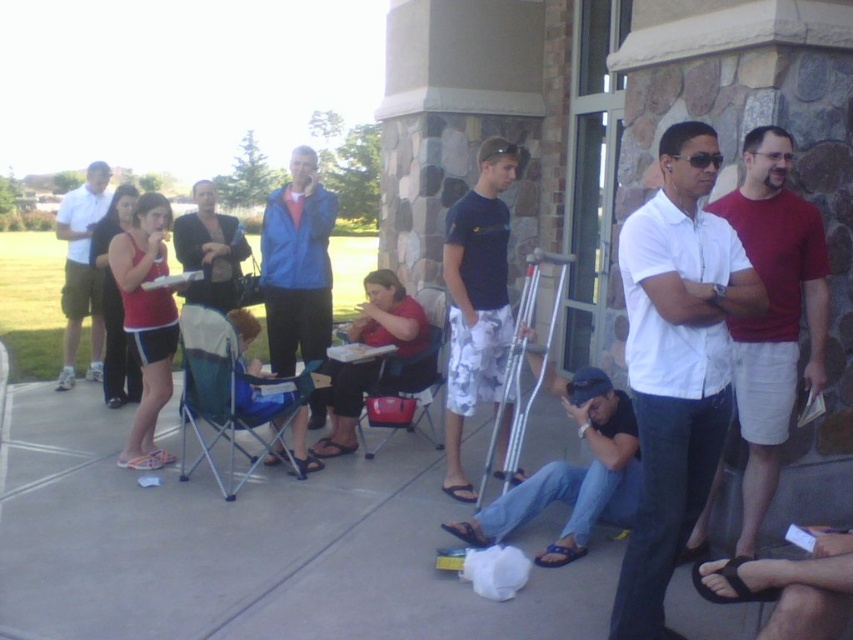
Can you confirm if denim jeans at lower center is taller than blue fabric chair at center?

No, denim jeans at lower center is not taller than blue fabric chair at center.

Measure the distance between denim jeans at lower center and blue fabric chair at center.

denim jeans at lower center and blue fabric chair at center are 1.36 meters apart from each other.

Does point (576, 502) lie in front of point (436, 340)?

Yes, it is in front of point (436, 340).

Locate an element on the screen. The height and width of the screenshot is (640, 853). denim jeans at lower center is located at coordinates (572, 476).

Does white cotton shirt at center appear on the right side of white matte shorts at left?

Yes, white cotton shirt at center is to the right of white matte shorts at left.

Can you confirm if white cotton shirt at center is thinner than white matte shorts at left?

Yes.

The height and width of the screenshot is (640, 853). Identify the location of white cotton shirt at center. (676, 364).

Based on the photo, who is shorter, dark blue t-shirt at center or blue fabric chair at center?

With less height is blue fabric chair at center.

Based on the photo, how much distance is there between dark blue t-shirt at center and blue fabric chair at center?

dark blue t-shirt at center and blue fabric chair at center are 23.71 inches apart from each other.

The image size is (853, 640). What do you see at coordinates (476, 300) in the screenshot?
I see `dark blue t-shirt at center` at bounding box center [476, 300].

Where is `dark blue t-shirt at center`? This screenshot has width=853, height=640. dark blue t-shirt at center is located at coordinates (476, 300).